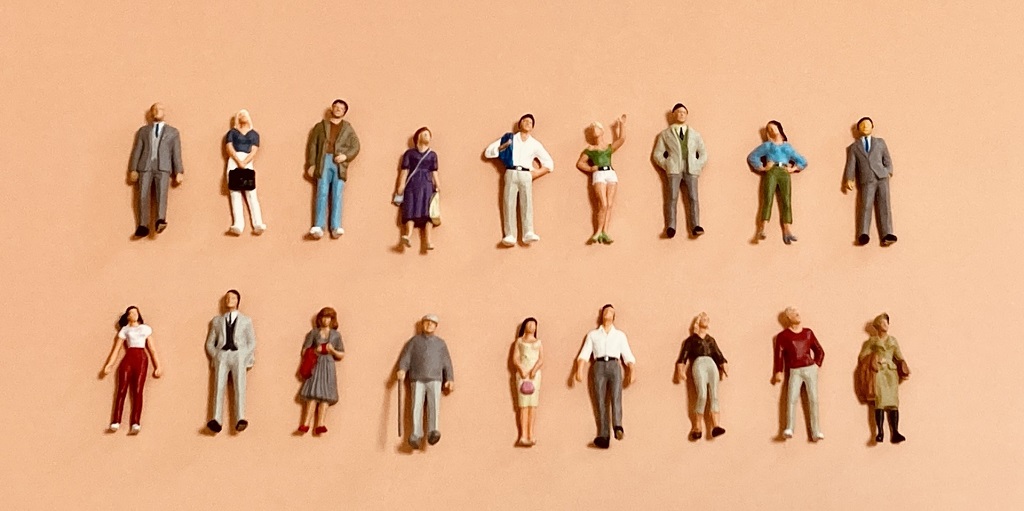
At what (x,y) coordinates should I click in order to perform the action: click on figurines of women. Please return your answer as a coordinate pair (x, y). Looking at the image, I should click on (241, 183), (415, 189), (611, 174), (772, 170), (878, 367), (708, 356), (316, 371), (134, 370).